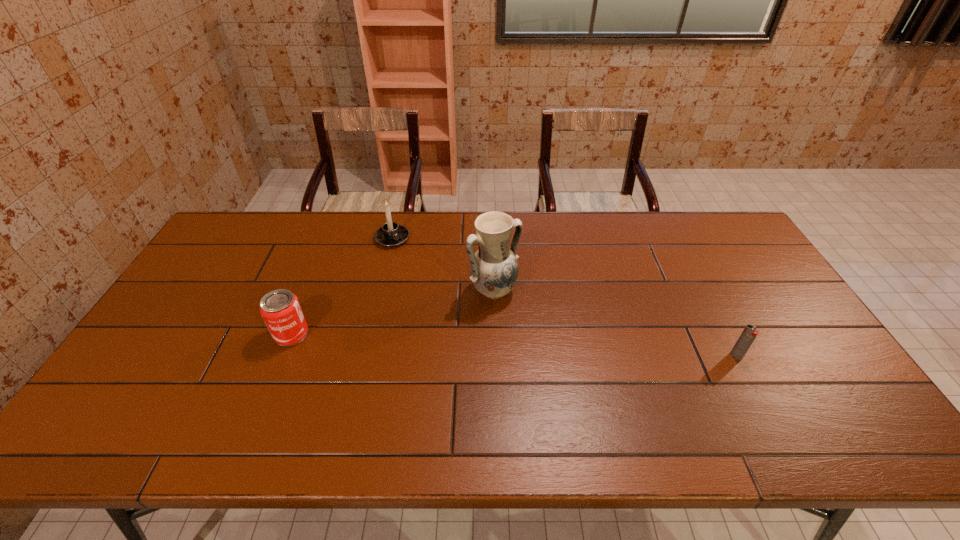
At what (x,y) coordinates should I click in order to perform the action: click on vacant space on the desktop that is between the third tallest object and the shortest object and is positioned with a handle on the side of the farthest object. Please return your answer as a coordinate pair (x, y). Image resolution: width=960 pixels, height=540 pixels. Looking at the image, I should click on (476, 343).

At what (x,y) coordinates should I click in order to perform the action: click on free space on the desktop that is between the can and the igniter and is positioned on either side of the tallest object. Please return your answer as a coordinate pair (x, y). The width and height of the screenshot is (960, 540). Looking at the image, I should click on (550, 347).